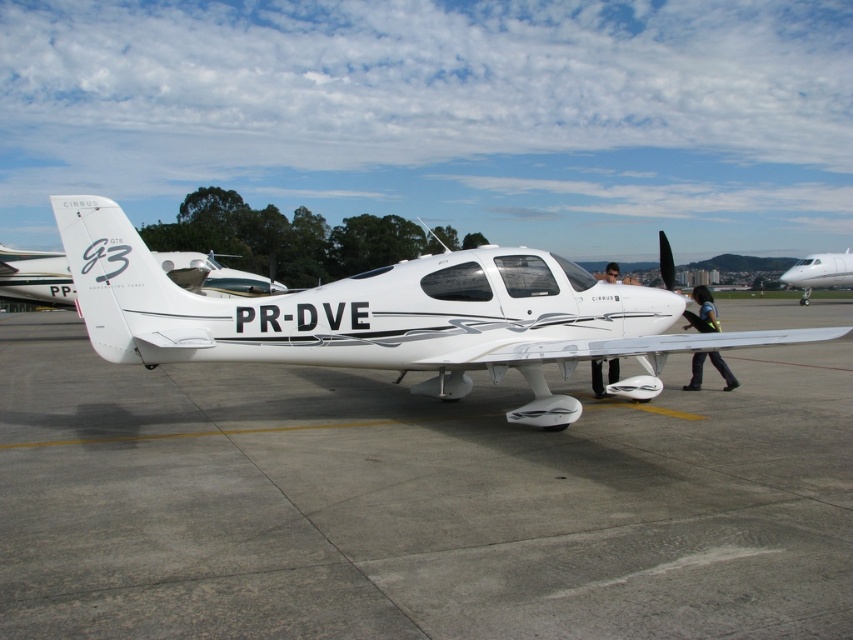
Question: Which point appears farthest from the camera in this image?

Choices:
 (A) (131, 260)
 (B) (180, 611)

Answer: (A)

Question: Is white matte airplane at center behind white glossy airplane at center?

Choices:
 (A) no
 (B) yes

Answer: (B)

Question: Is gray concrete tarmac at center positioned behind white glossy airplane at right?

Choices:
 (A) no
 (B) yes

Answer: (A)

Question: Which object appears closest to the camera in this image?

Choices:
 (A) gray concrete tarmac at center
 (B) matte black helmet at center
 (C) white matte airplane at center
 (D) white glossy airplane at right

Answer: (A)

Question: Based on their relative distances, which object is nearer to the white glossy airplane at center?

Choices:
 (A) matte black helmet at center
 (B) gray concrete tarmac at center
 (C) white matte airplane at center
 (D) white glossy airplane at right

Answer: (B)

Question: Where is white matte airplane at center located in relation to matte black helmet at center in the image?

Choices:
 (A) right
 (B) left

Answer: (B)